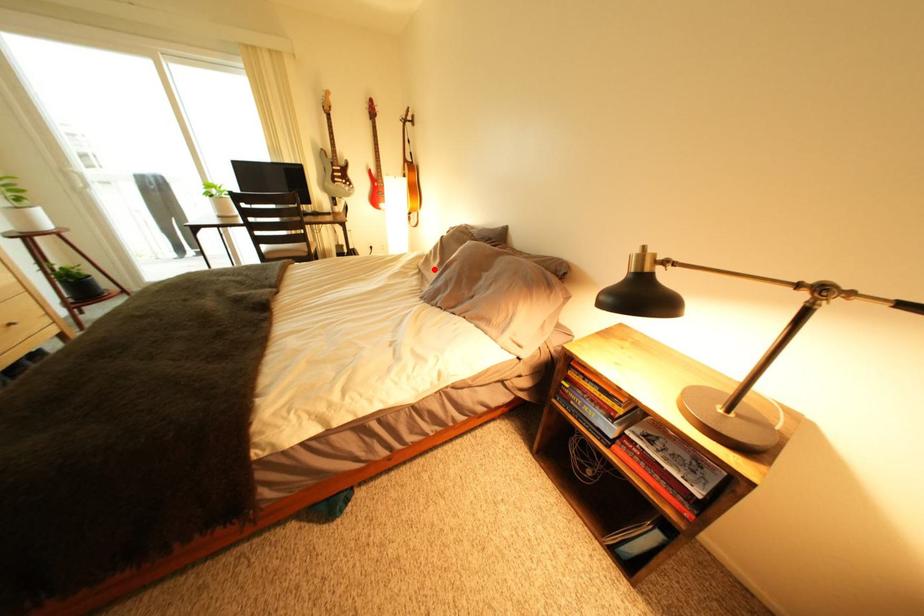
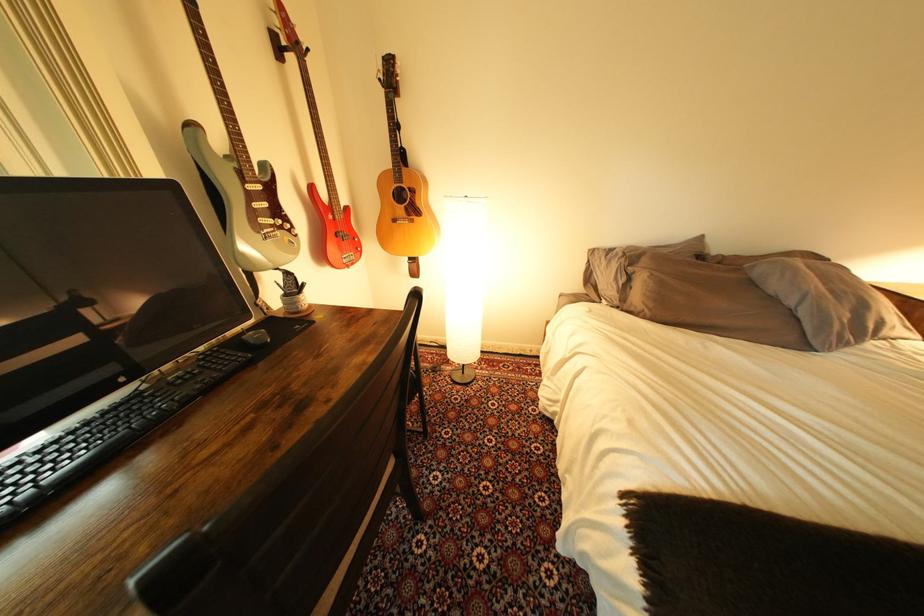
Where in the second image is the point corresponding to the highlighted location from the first image?

(701, 322)